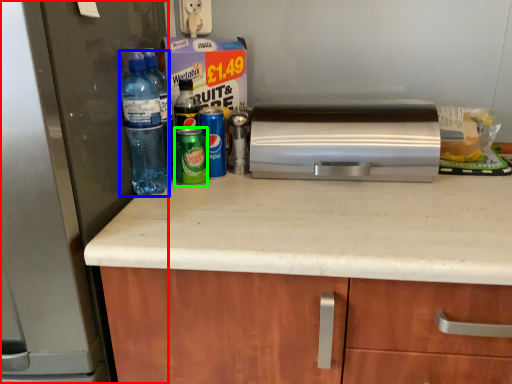
Question: Estimate the real-world distances between objects in this image. Which object is farther from refrigerator (highlighted by a red box), bottle (highlighted by a blue box) or beverage (highlighted by a green box)?

Choices:
 (A) bottle
 (B) beverage

Answer: (B)